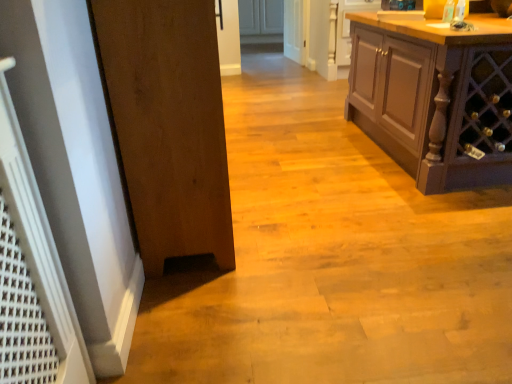
Question: In the image, is wooden door at left positioned in front of or behind matte brown cabinet at right?

Choices:
 (A) behind
 (B) front

Answer: (B)

Question: Is point (209, 130) closer or farther from the camera than point (463, 79)?

Choices:
 (A) closer
 (B) farther

Answer: (A)

Question: Estimate the real-world distances between objects in this image. Which object is closer to the matte brown cabinet at right?

Choices:
 (A) white glossy door at center
 (B) wooden door at left

Answer: (B)

Question: Estimate the real-world distances between objects in this image. Which object is farther from the white glossy door at center?

Choices:
 (A) wooden door at left
 (B) matte brown cabinet at right

Answer: (A)